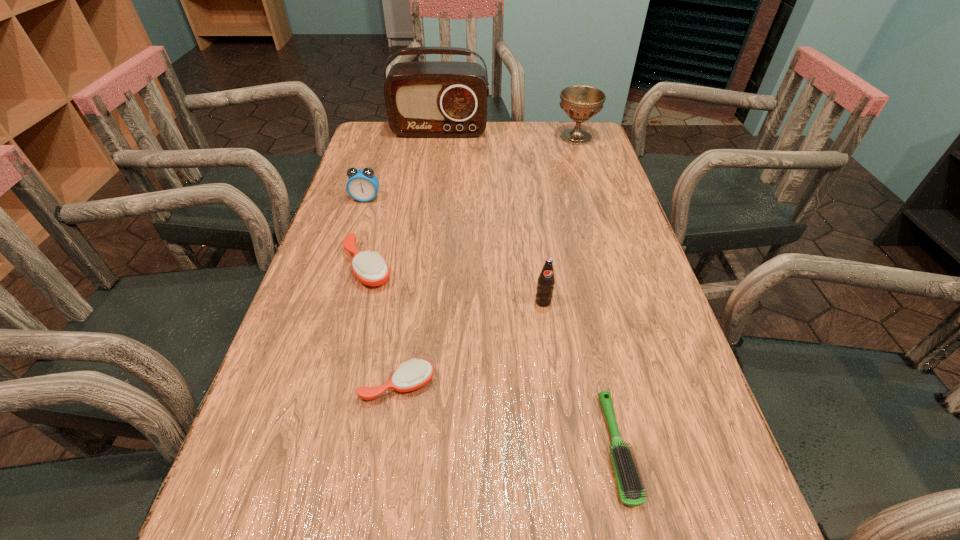
Locate an element on the screen. The image size is (960, 540). the tallest object is located at coordinates (427, 99).

This screenshot has width=960, height=540. Find the location of `the rightmost object`. the rightmost object is located at coordinates (580, 103).

You are a GUI agent. You are given a task and a screenshot of the screen. Output one action in this format:
    pyautogui.click(x=<x>, y=<y>)
    Task: Click on the red chalice
    
    Given the screenshot: What is the action you would take?
    pyautogui.click(x=580, y=103)

The width and height of the screenshot is (960, 540). I want to click on pop, so click(x=545, y=284).

Where is `the third object from right to left`? The height and width of the screenshot is (540, 960). the third object from right to left is located at coordinates (545, 284).

At what (x,y) coordinates should I click in order to perform the action: click on the fifth nearest object. Please return your answer as a coordinate pair (x, y). This screenshot has height=540, width=960. Looking at the image, I should click on (362, 185).

Image resolution: width=960 pixels, height=540 pixels. In order to click on alarm clock in this screenshot , I will do `click(362, 185)`.

Find the location of a particular element. The image size is (960, 540). the fourth nearest object is located at coordinates (371, 269).

Image resolution: width=960 pixels, height=540 pixels. Find the location of `the farther orange hairbrush`. the farther orange hairbrush is located at coordinates (371, 269).

Locate an element on the screen. the nearer orange hairbrush is located at coordinates (412, 375).